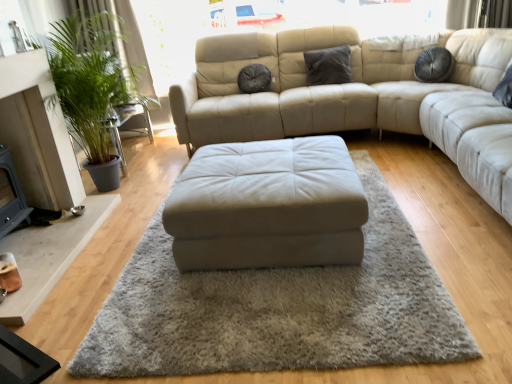
Question: Does point (232, 244) appear closer or farther from the camera than point (375, 175)?

Choices:
 (A) closer
 (B) farther

Answer: (A)

Question: Considering the positions of beige leather ottoman at center and beige leather ottoman at center in the image, is beige leather ottoman at center bigger or smaller than beige leather ottoman at center?

Choices:
 (A) big
 (B) small

Answer: (A)

Question: Which is farther from the beige leather ottoman at center?

Choices:
 (A) green leafy plant at left
 (B) beige leather ottoman at center
 (C) suede-like gray pillow at center, which appears as the 1th pillow when viewed from the left
 (D) green leafy plant at left
 (E) dark gray fabric pillow at center, the 1th pillow in the right-to-left sequence

Answer: (A)

Question: Which object is the farthest from the beige leather ottoman at center?

Choices:
 (A) beige leather ottoman at center
 (B) green leafy plant at left
 (C) green leafy plant at left
 (D) green leafy plant at left
 (E) suede-like gray pillow at center, which appears as the 1th pillow when viewed from the left

Answer: (C)